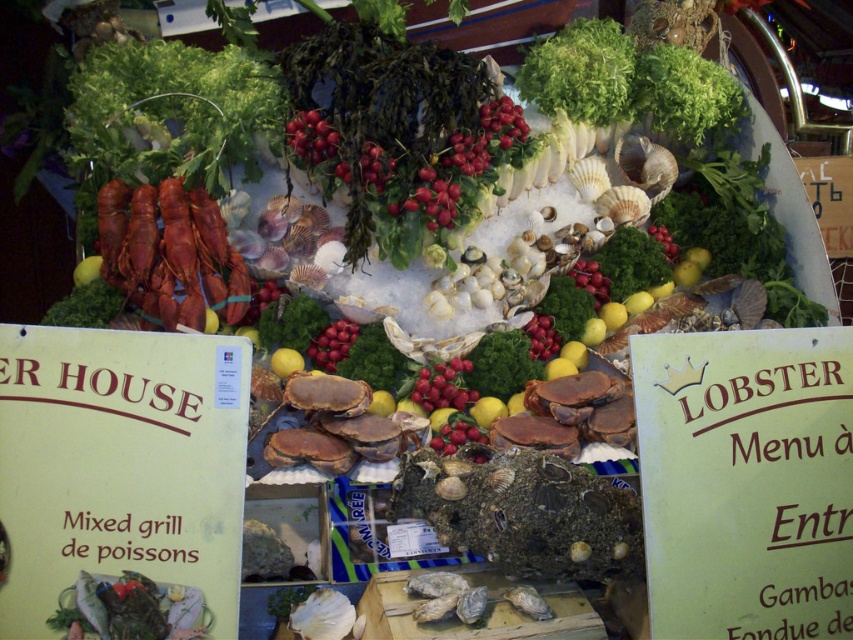
Please provide the 2D coordinates of the shiny red tomatoes at center in the image. The coordinates should be in the format of a point with two decimal places, such as point X, Y.

The shiny red tomatoes at center are located at point (311, 138).

You are a customer at the seafood display and want to pick up both the shiny red tomatoes at center and the shiny red grapes at center. Which one should you grab first if you want to start from the left side?

You should grab the shiny red tomatoes at center first since it is located to the left of the shiny red grapes at center.